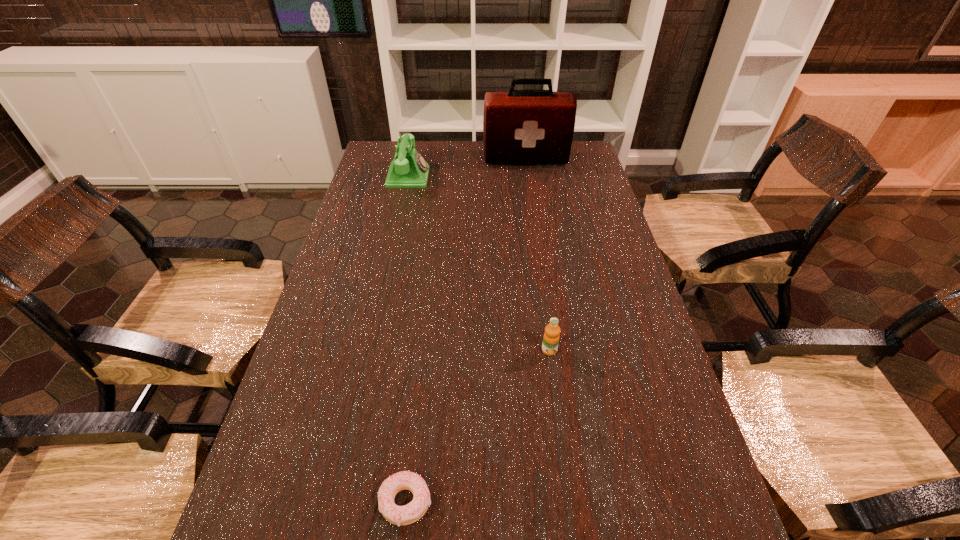
This screenshot has width=960, height=540. Find the location of `free spot between the first aid kit and the telephone`. free spot between the first aid kit and the telephone is located at coordinates (468, 168).

Image resolution: width=960 pixels, height=540 pixels. Find the location of `vacant space that's between the telephone and the tallest object`. vacant space that's between the telephone and the tallest object is located at coordinates (468, 168).

Where is `the third closest object to the second object from left to right`? the third closest object to the second object from left to right is located at coordinates (519, 126).

Where is `object that is the second closest to the first aid kit`? object that is the second closest to the first aid kit is located at coordinates (551, 336).

Locate an element on the screen. vacant space that satisfies the following two spatial constraints: 1. on the side of the tallest object with the cross symbol; 2. on the dial of the leftmost object is located at coordinates (528, 177).

Where is `free space that satisfies the following two spatial constraints: 1. on the side of the first aid kit with the cross symbol; 2. on the dial of the leftmost object`? Image resolution: width=960 pixels, height=540 pixels. free space that satisfies the following two spatial constraints: 1. on the side of the first aid kit with the cross symbol; 2. on the dial of the leftmost object is located at coordinates (528, 177).

Identify the location of free spot that satisfies the following two spatial constraints: 1. on the dial of the third shortest object; 2. on the back side of the shortest object. The image size is (960, 540). tap(337, 502).

This screenshot has height=540, width=960. Identify the location of free space that satisfies the following two spatial constraints: 1. on the side of the first aid kit with the cross symbol; 2. on the dial of the third shortest object. (528, 177).

This screenshot has width=960, height=540. What are the coordinates of `vacant space that satisfies the following two spatial constraints: 1. on the dial of the telephone; 2. on the right side of the nearest object` in the screenshot? It's located at (337, 502).